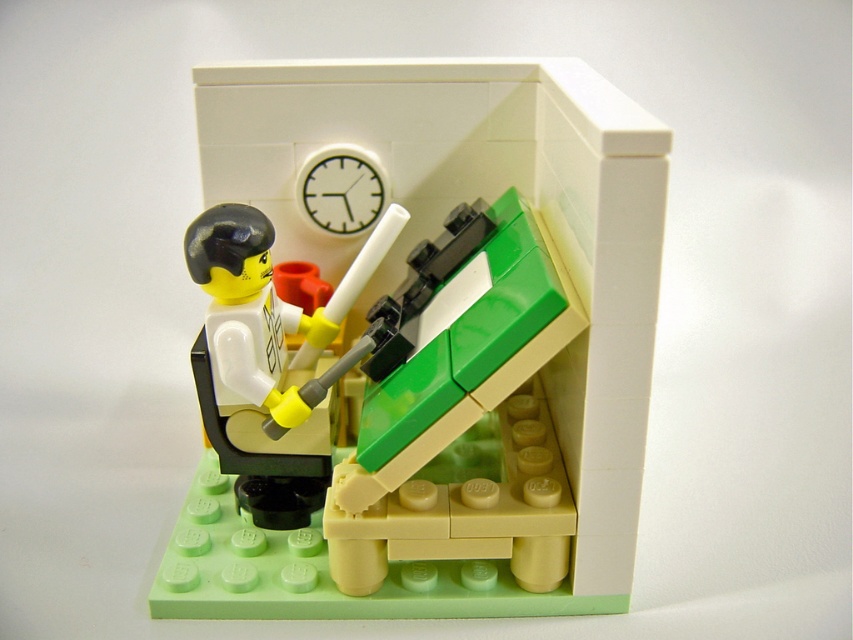
Which of these two, matte green plastic desk at center or white plastic clock at upper center, stands taller?

With more height is matte green plastic desk at center.

Is point (468, 180) positioned before point (350, 225)?

No, (468, 180) is behind (350, 225).

Does point (653, 157) come behind point (347, 227)?

No, (653, 157) is in front of (347, 227).

Identify the location of matte green plastic desk at center. (425, 342).

Who is more forward, (392, 221) or (381, 198)?

Positioned in front is point (392, 221).

Find the location of a particular element. yellow matte figure at center-left is located at coordinates (264, 353).

The height and width of the screenshot is (640, 853). What are the coordinates of `yellow matte figure at center-left` in the screenshot? It's located at (264, 353).

Is point (515, 598) farther from viewer compared to point (219, 321)?

Yes, it is behind point (219, 321).

Locate an element on the screen. The width and height of the screenshot is (853, 640). matte green plastic desk at center is located at coordinates (425, 342).

This screenshot has height=640, width=853. In order to click on matte green plastic desk at center in this screenshot , I will do `click(425, 342)`.